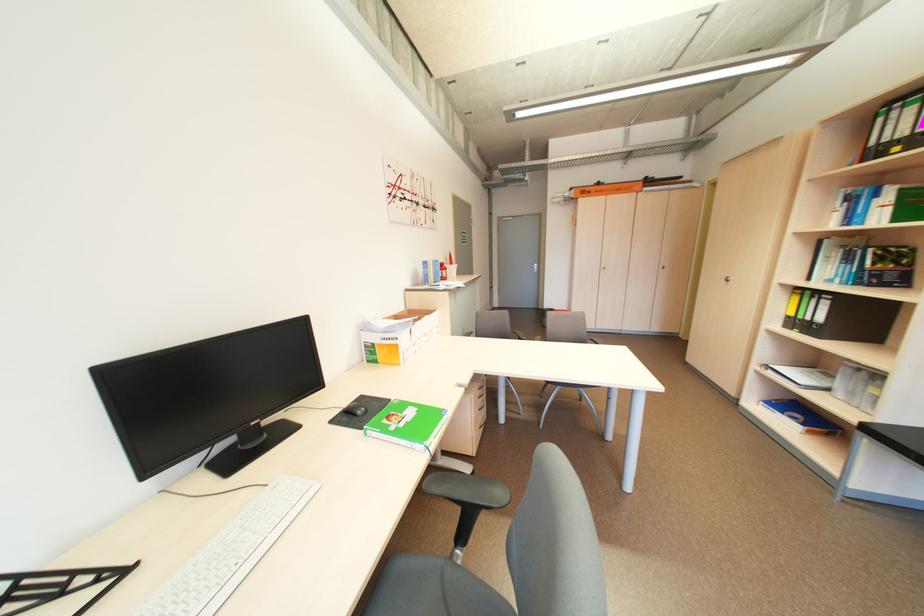
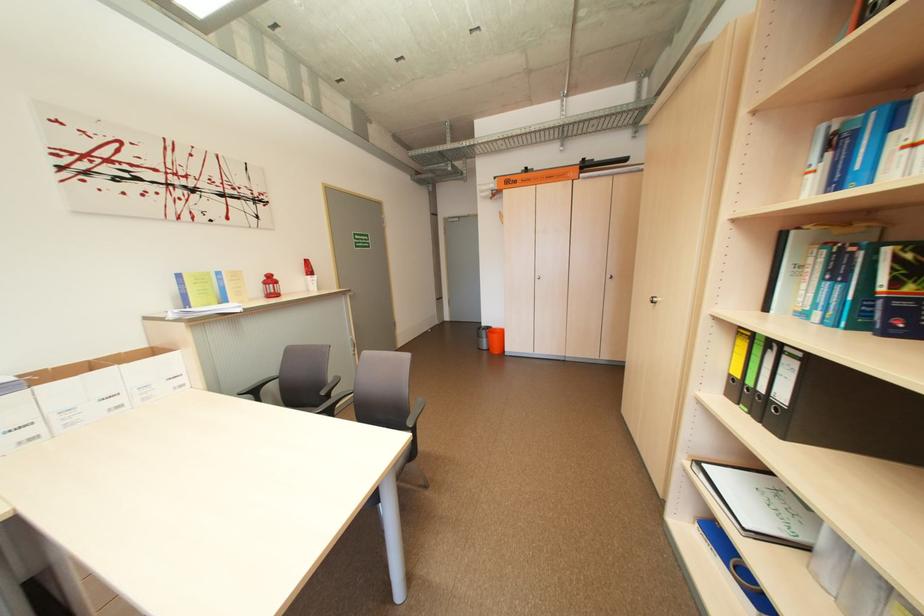
What movement of the cameraman would produce the second image?

The cameraman walked toward right, forward.